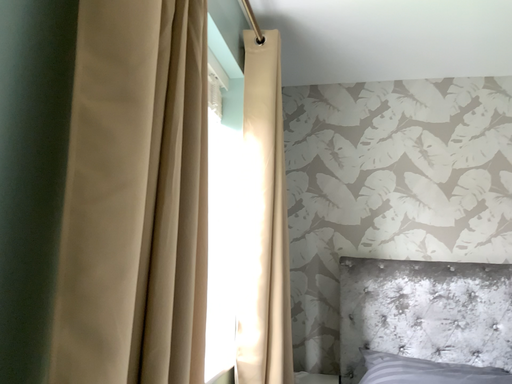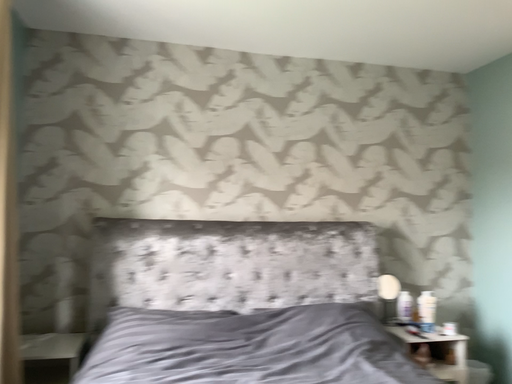
Question: How did the camera likely rotate when shooting the video?

Choices:
 (A) rotated right
 (B) rotated left

Answer: (A)